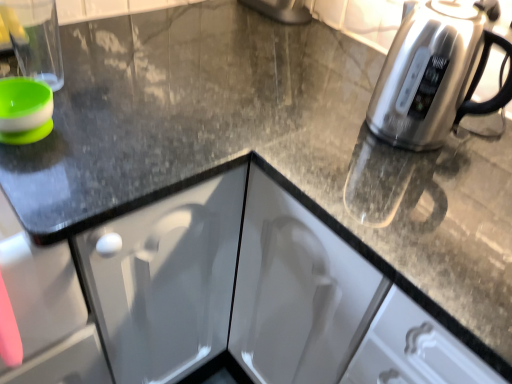
Identify the location of vacant space in satin silver kettle at right (from a real-world perspective). (407, 144).